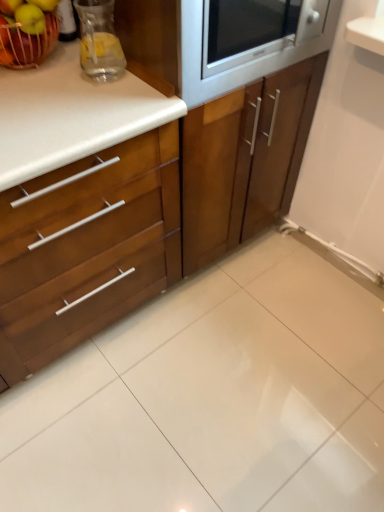
What is the approximate height of clear glass pitcher at upper left?

It is 7.32 inches.

In order to face wooden cabinet at left, which ranks as the 2th cabinetry in right-to-left order, should I rotate leftwards or rightwards?

Turn left approximately 20.246 degrees to face it.

Measure the distance between shiny red apple at upper left, which appears as the first apple when viewed from the left, and camera.

The distance of shiny red apple at upper left, which appears as the first apple when viewed from the left, from camera is 1.03 meters.

At what (x,y) coordinates should I click in order to perform the action: click on green matte apple at upper left, which appears as the 1th apple when viewed from the right. Please return your answer as a coordinate pair (x, y). The width and height of the screenshot is (384, 512). Looking at the image, I should click on (30, 18).

Find the location of a particular element. satin silver microwave at upper center is located at coordinates (241, 64).

Measure the distance between white glossy ceramic tile at center and camera.

3.99 feet.

What is the approximate width of white glossy ceramic tile at center?

white glossy ceramic tile at center is 1.05 meters in width.

The image size is (384, 512). What are the coordinates of `clear glass pitcher at upper left` in the screenshot? It's located at (99, 40).

Based on the photo, would you say white glossy ceramic tile at center is part of shiny red apple at upper left, the 2th apple in the right-to-left sequence,'s contents?

No, white glossy ceramic tile at center is not a part of shiny red apple at upper left, the 2th apple in the right-to-left sequence.

Consider the image. Can you confirm if shiny red apple at upper left, the 2th apple in the right-to-left sequence, is shorter than white glossy ceramic tile at center?

In fact, shiny red apple at upper left, the 2th apple in the right-to-left sequence, may be taller than white glossy ceramic tile at center.

Between point (45, 9) and point (300, 374), which one is positioned in front?

The point (45, 9) is more forward.

Is green matte apple at upper left, placed as the second apple when sorted from left to right, outside of wooden cabinet at left, which ranks as the 2th cabinetry in right-to-left order?

green matte apple at upper left, placed as the second apple when sorted from left to right, is positioned outside wooden cabinet at left, which ranks as the 2th cabinetry in right-to-left order.

Which is behind, green matte apple at upper left, placed as the second apple when sorted from left to right, or wooden cabinet at left, which appears as the 1th cabinetry when viewed from the left?

green matte apple at upper left, placed as the second apple when sorted from left to right.

Is green matte apple at upper left, which appears as the 1th apple when viewed from the right, far away from wooden cabinet at left, which ranks as the 2th cabinetry in right-to-left order?

No, green matte apple at upper left, which appears as the 1th apple when viewed from the right, is not far away from wooden cabinet at left, which ranks as the 2th cabinetry in right-to-left order.

From the image's perspective, which is below, clear glass pitcher at upper left or white glossy ceramic tile at center?

white glossy ceramic tile at center, from the image's perspective.

Is clear glass pitcher at upper left inside or outside of white glossy ceramic tile at center?

clear glass pitcher at upper left is not inside white glossy ceramic tile at center, it's outside.

Does clear glass pitcher at upper left have a lesser height compared to white glossy ceramic tile at center?

In fact, clear glass pitcher at upper left may be taller than white glossy ceramic tile at center.

Is wooden cabinet at center, positioned as the 1th cabinetry in right-to-left order, bigger or smaller than wooden cabinet at left, which ranks as the 2th cabinetry in right-to-left order?

In the image, wooden cabinet at center, positioned as the 1th cabinetry in right-to-left order, appears to be smaller than wooden cabinet at left, which ranks as the 2th cabinetry in right-to-left order.

Is wooden cabinet at left, which appears as the 1th cabinetry when viewed from the left, inside wooden cabinet at center, positioned as the 1th cabinetry in right-to-left order?

No, wooden cabinet at left, which appears as the 1th cabinetry when viewed from the left, is not surrounded by wooden cabinet at center, positioned as the 1th cabinetry in right-to-left order.

Which of these two, wooden cabinet at center, positioned as the 1th cabinetry in right-to-left order, or wooden cabinet at left, which appears as the 1th cabinetry when viewed from the left, is thinner?

wooden cabinet at left, which appears as the 1th cabinetry when viewed from the left.

From their relative heights in the image, would you say green matte apple at upper left, placed as the second apple when sorted from left to right, is taller or shorter than satin silver microwave at upper center?

In the image, green matte apple at upper left, placed as the second apple when sorted from left to right, appears to be shorter than satin silver microwave at upper center.

Does green matte apple at upper left, placed as the second apple when sorted from left to right, come behind satin silver microwave at upper center?

Yes, it is.

Where is `microwave oven that appears on the right of green matte apple at upper left, which appears as the 1th apple when viewed from the right`? This screenshot has width=384, height=512. microwave oven that appears on the right of green matte apple at upper left, which appears as the 1th apple when viewed from the right is located at coordinates (241, 64).

Is green matte apple at upper left, which appears as the 1th apple when viewed from the right, surrounding satin silver microwave at upper center?

No, satin silver microwave at upper center is not surrounded by green matte apple at upper left, which appears as the 1th apple when viewed from the right.

Consider the image. Relative to clear glass pitcher at upper left, is white glossy ceramic tile at center in front or behind?

white glossy ceramic tile at center is positioned closer to the viewer than clear glass pitcher at upper left.

From the image's perspective, is white glossy ceramic tile at center on clear glass pitcher at upper left?

No, from the image's perspective, white glossy ceramic tile at center is not above clear glass pitcher at upper left.

Which is more to the right, white glossy ceramic tile at center or clear glass pitcher at upper left?

Positioned to the right is white glossy ceramic tile at center.

Which of these two, white glossy ceramic tile at center or clear glass pitcher at upper left, is smaller?

clear glass pitcher at upper left.

Is wooden cabinet at center, positioned as the 1th cabinetry in right-to-left order, far away from shiny red apple at upper left, the 2th apple in the right-to-left sequence?

Actually, wooden cabinet at center, positioned as the 1th cabinetry in right-to-left order, and shiny red apple at upper left, the 2th apple in the right-to-left sequence, are a little close together.

Can shiny red apple at upper left, which appears as the first apple when viewed from the left, be found inside wooden cabinet at center, which is counted as the 2th cabinetry, starting from the left?

No, shiny red apple at upper left, which appears as the first apple when viewed from the left, is not surrounded by wooden cabinet at center, which is counted as the 2th cabinetry, starting from the left.

Which of these two, wooden cabinet at center, which is counted as the 2th cabinetry, starting from the left, or shiny red apple at upper left, which appears as the first apple when viewed from the left, stands shorter?

shiny red apple at upper left, which appears as the first apple when viewed from the left.

Does wooden cabinet at center, which is counted as the 2th cabinetry, starting from the left, appear on the right side of shiny red apple at upper left, which appears as the first apple when viewed from the left?

Yes.

At what (x,y) coordinates should I click in order to perform the action: click on ceramic tile in front of the shiny red apple at upper left, the 2th apple in the right-to-left sequence. Please return your answer as a coordinate pair (x, y). Looking at the image, I should click on (241, 400).

From the image's perspective, starting from the wooden cabinet at left, which ranks as the 2th cabinetry in right-to-left order, which apple is the 2nd one above? Please provide its 2D coordinates.

[(30, 18)]

Estimate the real-world distances between objects in this image. Which object is closer to shiny red apple at upper left, which appears as the first apple when viewed from the left, wooden cabinet at center, positioned as the 1th cabinetry in right-to-left order, or green matte apple at upper left, which appears as the 1th apple when viewed from the right?

green matte apple at upper left, which appears as the 1th apple when viewed from the right.

Looking at the image, which one is located further to clear glass pitcher at upper left, shiny red apple at upper left, the 2th apple in the right-to-left sequence, or satin silver microwave at upper center?

satin silver microwave at upper center is further to clear glass pitcher at upper left.

From the image, which object appears to be farther from wooden cabinet at center, which is counted as the 2th cabinetry, starting from the left, wooden cabinet at left, which ranks as the 2th cabinetry in right-to-left order, or clear glass pitcher at upper left?

clear glass pitcher at upper left is positioned further to the anchor wooden cabinet at center, which is counted as the 2th cabinetry, starting from the left.

From the image, which object appears to be nearer to green matte apple at upper left, placed as the second apple when sorted from left to right, white glossy ceramic tile at center or shiny red apple at upper left, the 2th apple in the right-to-left sequence?

shiny red apple at upper left, the 2th apple in the right-to-left sequence, is closer to green matte apple at upper left, placed as the second apple when sorted from left to right.

Looking at the image, which one is located closer to green matte apple at upper left, placed as the second apple when sorted from left to right, wooden cabinet at center, which is counted as the 2th cabinetry, starting from the left, or shiny red apple at upper left, the 2th apple in the right-to-left sequence?

shiny red apple at upper left, the 2th apple in the right-to-left sequence, lies closer to green matte apple at upper left, placed as the second apple when sorted from left to right, than the other object.

Looking at the image, which one is located closer to clear glass pitcher at upper left, wooden cabinet at center, which is counted as the 2th cabinetry, starting from the left, or wooden cabinet at left, which ranks as the 2th cabinetry in right-to-left order?

wooden cabinet at center, which is counted as the 2th cabinetry, starting from the left, is positioned closer to the anchor clear glass pitcher at upper left.

When comparing their distances from clear glass pitcher at upper left, does green matte apple at upper left, placed as the second apple when sorted from left to right, or wooden cabinet at center, which is counted as the 2th cabinetry, starting from the left, seem closer?

The object closer to clear glass pitcher at upper left is green matte apple at upper left, placed as the second apple when sorted from left to right.

Looking at the image, which one is located closer to wooden cabinet at center, which is counted as the 2th cabinetry, starting from the left, satin silver microwave at upper center or shiny red apple at upper left, which appears as the first apple when viewed from the left?

The object closer to wooden cabinet at center, which is counted as the 2th cabinetry, starting from the left, is satin silver microwave at upper center.

The image size is (384, 512). Find the location of `appliance between shiny red apple at upper left, which appears as the first apple when viewed from the left, and wooden cabinet at center, positioned as the 1th cabinetry in right-to-left order, from left to right`. appliance between shiny red apple at upper left, which appears as the first apple when viewed from the left, and wooden cabinet at center, positioned as the 1th cabinetry in right-to-left order, from left to right is located at coordinates (99, 40).

Identify the location of apple between green matte apple at upper left, placed as the second apple when sorted from left to right, and white glossy ceramic tile at center in the up-down direction. (27, 32).

Locate an element on the screen. The image size is (384, 512). cabinetry between shiny red apple at upper left, which appears as the first apple when viewed from the left, and satin silver microwave at upper center from left to right is located at coordinates (156, 182).

Locate an element on the screen. The width and height of the screenshot is (384, 512). apple situated between shiny red apple at upper left, which appears as the first apple when viewed from the left, and wooden cabinet at center, positioned as the 1th cabinetry in right-to-left order, from left to right is located at coordinates (30, 18).